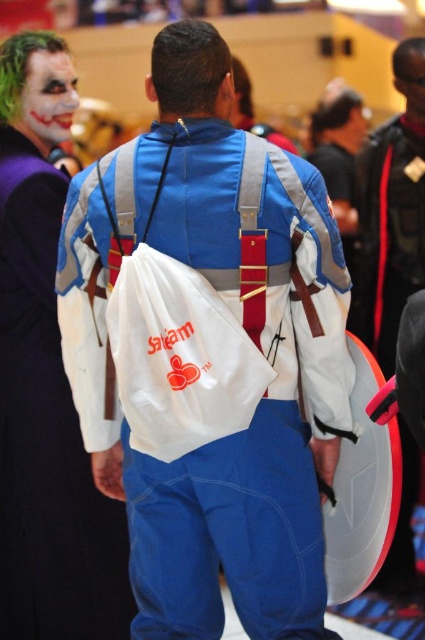
Between white fabric backpack at center and matte clown face at upper left, which one has less height?

Standing shorter between the two is matte clown face at upper left.

Is point (99, 449) closer to viewer compared to point (45, 125)?

Yes, it is.

Find the location of a particular element. white fabric backpack at center is located at coordinates (255, 346).

In the scene shown: How distant is white fabric backpack at center from white matte backpack at center?

24.16 inches

Between white fabric backpack at center and white matte backpack at center, which one is positioned higher?

Positioned higher is white fabric backpack at center.

Which is behind, point (215, 504) or point (124, 596)?

Positioned behind is point (124, 596).

The width and height of the screenshot is (425, 640). What are the coordinates of `white fabric backpack at center` in the screenshot? It's located at (255, 346).

Does point (53, 328) lie behind point (410, 221)?

No, it is not.

Which is behind, point (37, 225) or point (370, 340)?

Positioned behind is point (370, 340).

This screenshot has height=640, width=425. What do you see at coordinates (47, 435) in the screenshot? I see `white matte backpack at center` at bounding box center [47, 435].

At what (x,y) coordinates should I click in order to perform the action: click on white matte backpack at center. Please return your answer as a coordinate pair (x, y). The image size is (425, 640). Looking at the image, I should click on (47, 435).